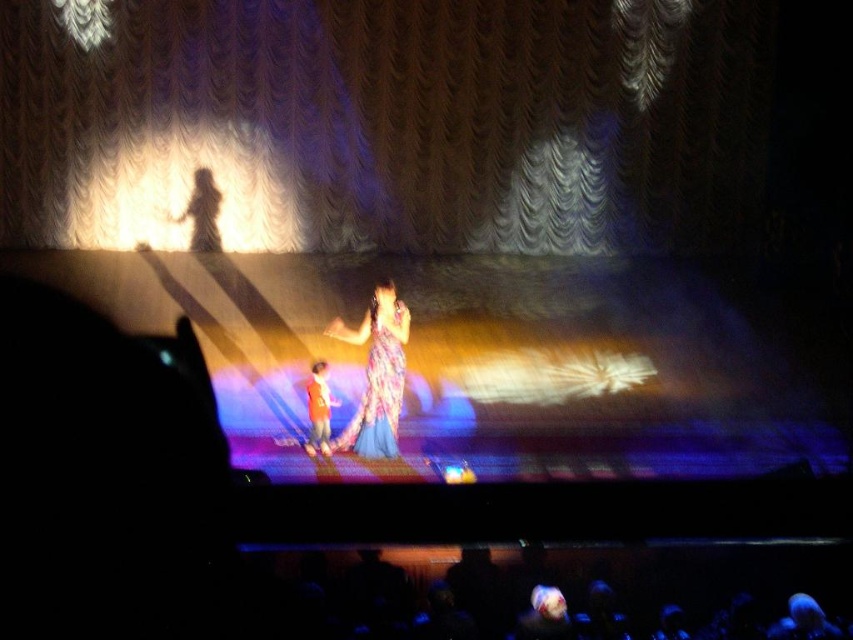
Can you confirm if white textured curtain at upper center is positioned below floral chiffon dress at center?

Incorrect, white textured curtain at upper center is not positioned below floral chiffon dress at center.

Which is behind, point (712, 122) or point (373, 451)?

The point (712, 122) is behind.

The width and height of the screenshot is (853, 640). Identify the location of white textured curtain at upper center. (383, 124).

The width and height of the screenshot is (853, 640). Identify the location of white textured curtain at upper center. (383, 124).

Looking at this image, can you confirm if floral chiffon dress at center is positioned to the left of orange fabric at center?

No, floral chiffon dress at center is not to the left of orange fabric at center.

At what (x,y) coordinates should I click in order to perform the action: click on floral chiffon dress at center. Please return your answer as a coordinate pair (x, y). This screenshot has width=853, height=640. Looking at the image, I should click on (376, 387).

Is white textured curtain at upper center above orange fabric at center?

Yes, white textured curtain at upper center is above orange fabric at center.

Is point (703, 140) positioned before point (308, 438)?

No, (703, 140) is further to viewer.

This screenshot has width=853, height=640. Find the location of `white textured curtain at upper center`. white textured curtain at upper center is located at coordinates (383, 124).

Find the location of a particular element. white textured curtain at upper center is located at coordinates (383, 124).